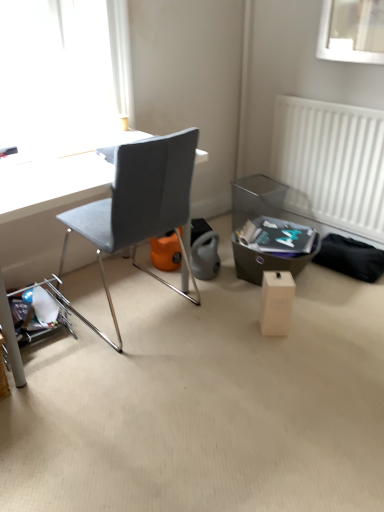
Question: From a real-world perspective, is white plastic radiator at right positioned over white cardboard box at center based on gravity?

Choices:
 (A) no
 (B) yes

Answer: (B)

Question: Does white plastic radiator at right have a lesser height compared to white cardboard box at center?

Choices:
 (A) no
 (B) yes

Answer: (A)

Question: Is white plastic radiator at right at the right side of white cardboard box at center?

Choices:
 (A) yes
 (B) no

Answer: (A)

Question: Considering the relative sizes of white plastic radiator at right and white cardboard box at center in the image provided, is white plastic radiator at right smaller than white cardboard box at center?

Choices:
 (A) yes
 (B) no

Answer: (B)

Question: From the image's perspective, would you say white plastic radiator at right is shown under white cardboard box at center?

Choices:
 (A) yes
 (B) no

Answer: (B)

Question: Considering the positions of white cardboard box at center and matte gray chair at center in the image, is white cardboard box at center wider or thinner than matte gray chair at center?

Choices:
 (A) thin
 (B) wide

Answer: (A)

Question: From a real-world perspective, is white cardboard box at center above or below matte gray chair at center?

Choices:
 (A) below
 (B) above

Answer: (A)

Question: Is point (264, 296) closer or farther from the camera than point (77, 211)?

Choices:
 (A) closer
 (B) farther

Answer: (B)

Question: Is white cardboard box at center situated inside matte gray chair at center or outside?

Choices:
 (A) outside
 (B) inside

Answer: (A)

Question: From a real-world perspective, is white cardboard box at center above or below white plastic radiator at right?

Choices:
 (A) below
 (B) above

Answer: (A)

Question: Does point 283,324 appear closer or farther from the camera than point 347,144?

Choices:
 (A) farther
 (B) closer

Answer: (B)

Question: Considering their positions, is white cardboard box at center located in front of or behind white plastic radiator at right?

Choices:
 (A) front
 (B) behind

Answer: (A)

Question: Considering the positions of white cardboard box at center and white plastic radiator at right in the image, is white cardboard box at center taller or shorter than white plastic radiator at right?

Choices:
 (A) short
 (B) tall

Answer: (A)

Question: From the image's perspective, is white plastic radiator at right positioned above or below white cardboard box at center?

Choices:
 (A) above
 (B) below

Answer: (A)

Question: Relative to white cardboard box at center, is white plastic radiator at right in front or behind?

Choices:
 (A) behind
 (B) front

Answer: (A)